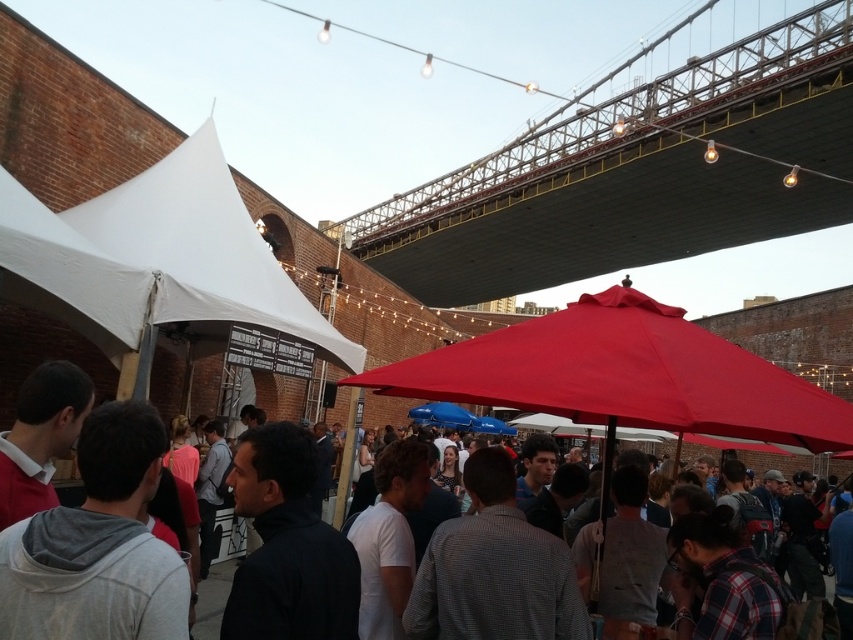
You are organizing a small event and need to choose between the red matte umbrella at center and the matte black umbrella at center for shade. Which one provides more coverage area?

The red matte umbrella at center has a larger size compared to the matte black umbrella at center, so it provides more coverage area.

You are standing at the event under the Williamsburg Bridge and want to take a photo of the metallic gray bridge at upper center. If your camera can focus on objects up to 60 meters away, will you need to adjust your position to capture the bridge clearly?

The metallic gray bridge at upper center is 70.34 meters away from the viewer, which is beyond the camera focus limit of 60 meters. To capture the bridge clearly, you need to move closer to reduce the distance.

You are planning to set up a temporary food stall for the event. The white fabric canopy at left is currently being used as a registration area. You need to place your stall at least 100 feet away from the registration area to avoid congestion. Can you set up your stall near the red matte umbrella at center?

The white fabric canopy at left is 70.97 feet from the red matte umbrella at center. Since 70.97 feet is less than the required 100 feet distance, you cannot set up your stall near the red matte umbrella at center as it is too close to the registration area.